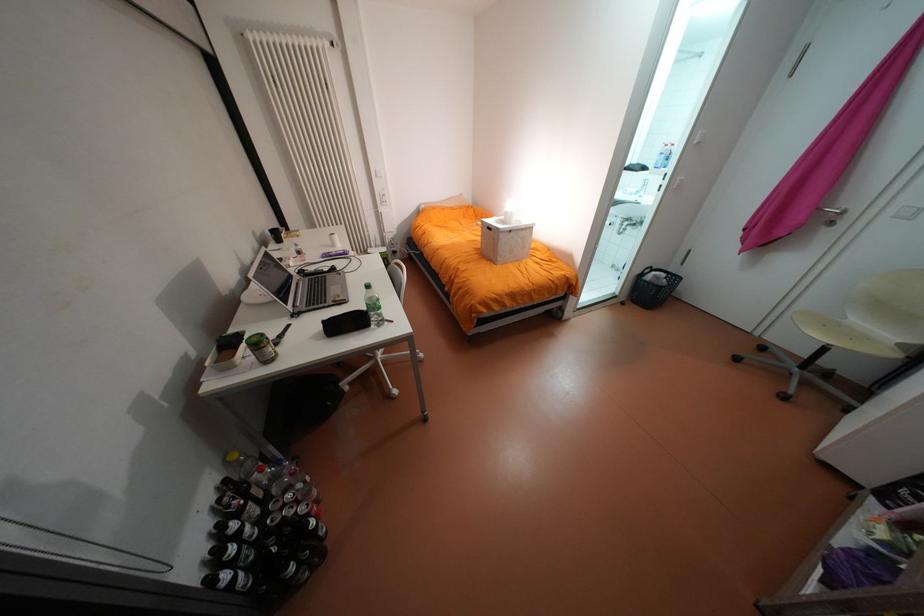
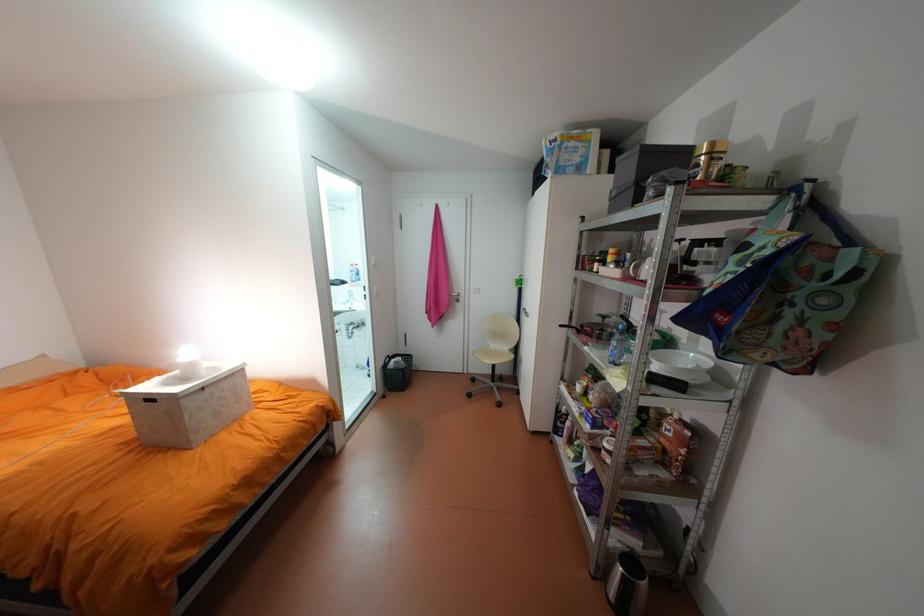
Where in the second image is the point corresponding to point (840, 323) from the first image?

(497, 352)